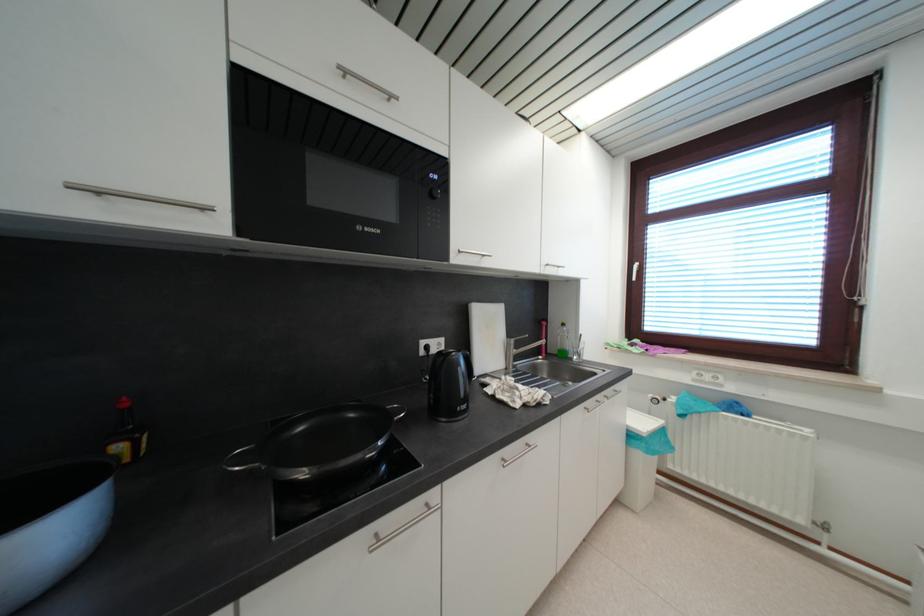
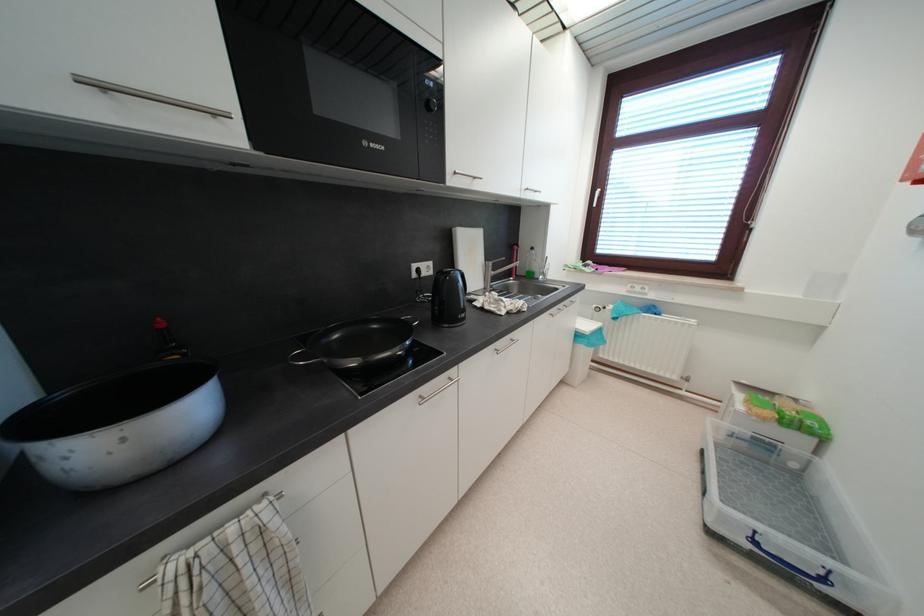
Locate, in the second image, the point that corresponds to (395,419) in the first image.

(412, 326)